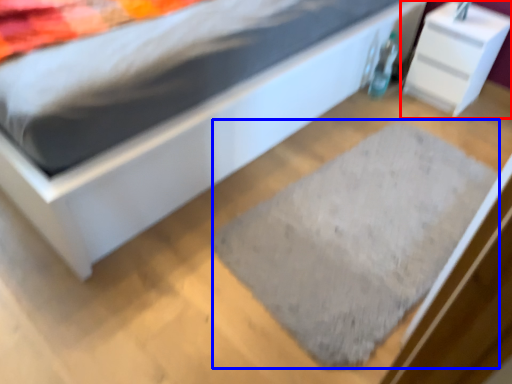
Question: Which of the following is the farthest to the observer, nightstand (highlighted by a red box) or doormat (highlighted by a blue box)?

Choices:
 (A) nightstand
 (B) doormat

Answer: (A)